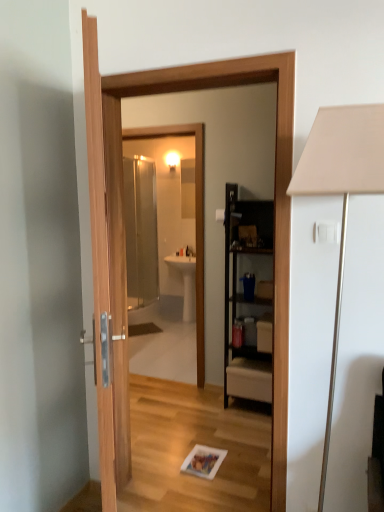
Question: Is black wood cabinet at center further to camera compared to white matte table lamp at right?

Choices:
 (A) no
 (B) yes

Answer: (B)

Question: Is white matte table lamp at right surrounded by black wood cabinet at center?

Choices:
 (A) no
 (B) yes

Answer: (A)

Question: Does black wood cabinet at center touch white matte table lamp at right?

Choices:
 (A) yes
 (B) no

Answer: (B)

Question: Can we say black wood cabinet at center lies outside white matte table lamp at right?

Choices:
 (A) yes
 (B) no

Answer: (A)

Question: From a real-world perspective, is black wood cabinet at center physically above white matte table lamp at right?

Choices:
 (A) no
 (B) yes

Answer: (A)

Question: Is black wood cabinet at center bigger or smaller than white glossy sink at center?

Choices:
 (A) small
 (B) big

Answer: (B)

Question: In terms of width, does black wood cabinet at center look wider or thinner when compared to white glossy sink at center?

Choices:
 (A) wide
 (B) thin

Answer: (B)

Question: Is black wood cabinet at center to the left or to the right of white glossy sink at center in the image?

Choices:
 (A) right
 (B) left

Answer: (A)

Question: Is point (243, 324) positioned closer to the camera than point (173, 265)?

Choices:
 (A) farther
 (B) closer

Answer: (B)

Question: Which is correct: transparent glass mirror at center is inside white matte table lamp at right, or outside of it?

Choices:
 (A) inside
 (B) outside

Answer: (B)

Question: Visually, is transparent glass mirror at center positioned to the left or to the right of white matte table lamp at right?

Choices:
 (A) left
 (B) right

Answer: (A)

Question: From the image's perspective, is transparent glass mirror at center positioned above or below white matte table lamp at right?

Choices:
 (A) above
 (B) below

Answer: (A)

Question: From a real-world perspective, relative to white matte table lamp at right, is transparent glass mirror at center vertically above or below?

Choices:
 (A) above
 (B) below

Answer: (A)

Question: In terms of width, does white matte table lamp at right look wider or thinner when compared to transparent glass mirror at center?

Choices:
 (A) thin
 (B) wide

Answer: (B)

Question: From the image's perspective, relative to transparent glass mirror at center, is white matte table lamp at right above or below?

Choices:
 (A) below
 (B) above

Answer: (A)